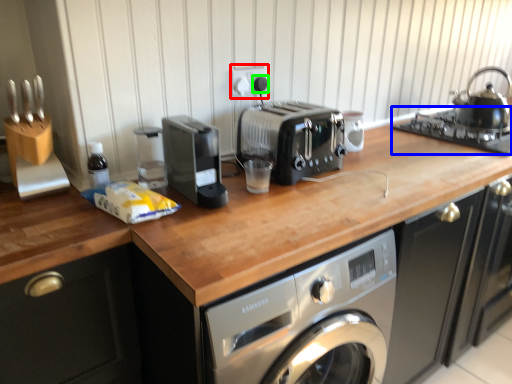
Question: Based on their relative distances, which object is nearer to electric outlet (highlighted by a red box)? Choose from gas stove (highlighted by a blue box) and knob (highlighted by a green box).

Choices:
 (A) gas stove
 (B) knob

Answer: (B)